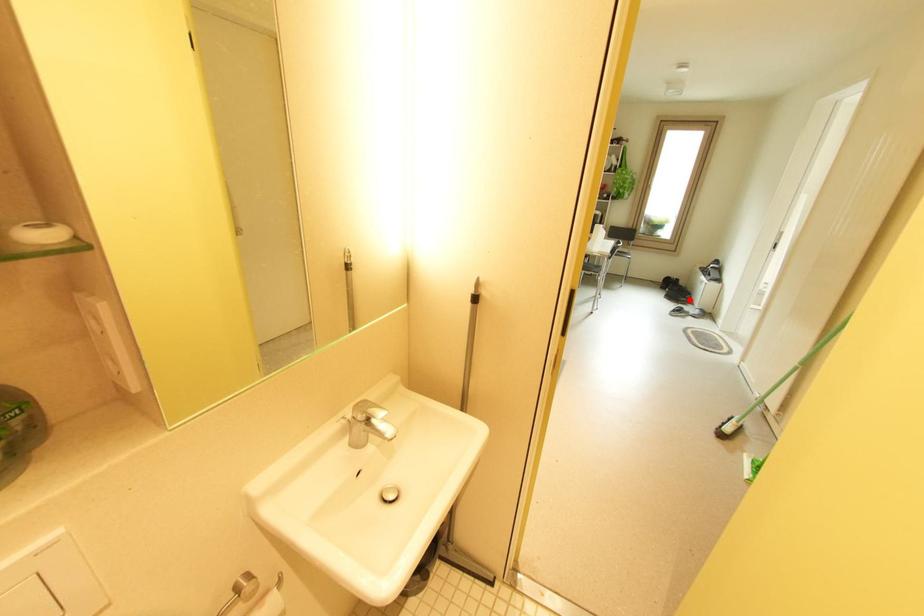
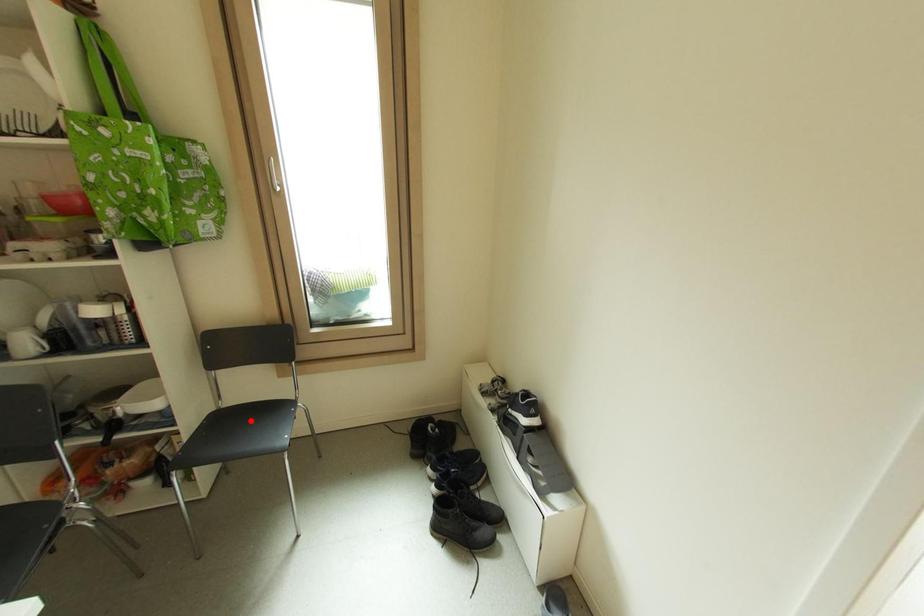
I am providing you with two images of the same scene from different viewpoints. A red point is marked on the first image and another point is marked on the second image. Are the points marked in image1 and image2 representing the same 3D position?

No